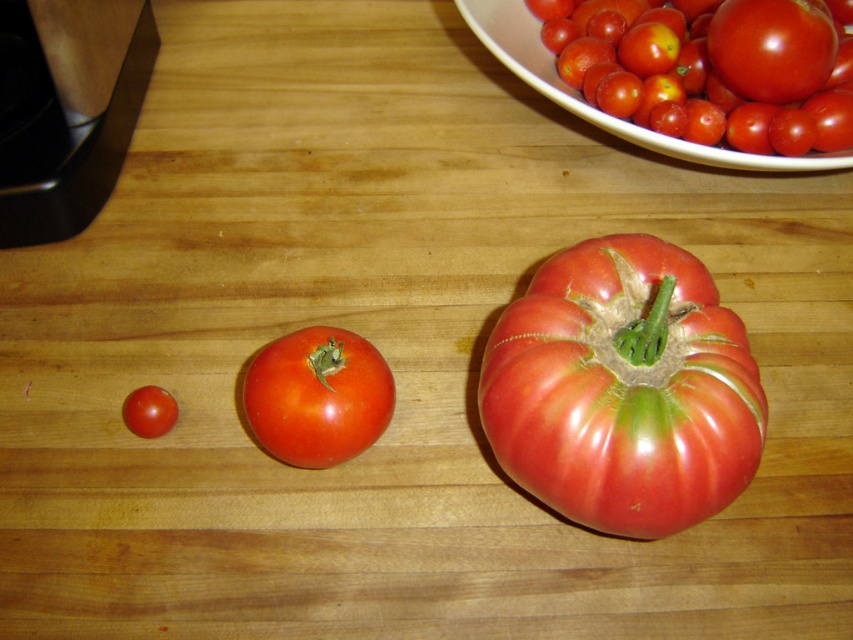
You are arranging tomatoes on a table and need to place a new tomato between the shiny red tomato at center and the glossy red tomato at lower left. Based on their positions, which tomato should be closer to you?

The shiny red tomato at center is in front of the glossy red tomato at lower left, so the shiny red tomato at center should be closer to you.

You are arranging tomatoes on a wooden table. You have a shiny red tomato at center and a glossy red tomato at lower left. Which tomato should you choose if you need the bigger one for a recipe?

The shiny red tomato at center is larger in size compared to the glossy red tomato at lower left, so you should choose the shiny red tomato at center.